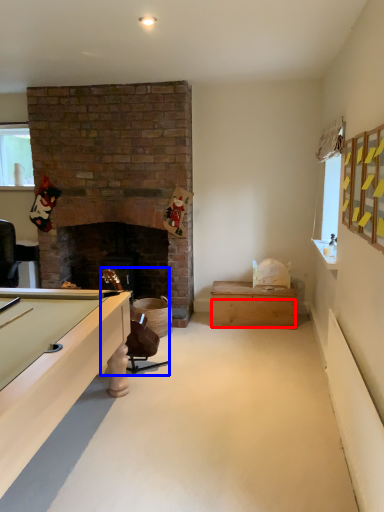
Question: Which point is closer to the camera, drawer (highlighted by a red box) or chair (highlighted by a blue box)?

Choices:
 (A) drawer
 (B) chair

Answer: (B)